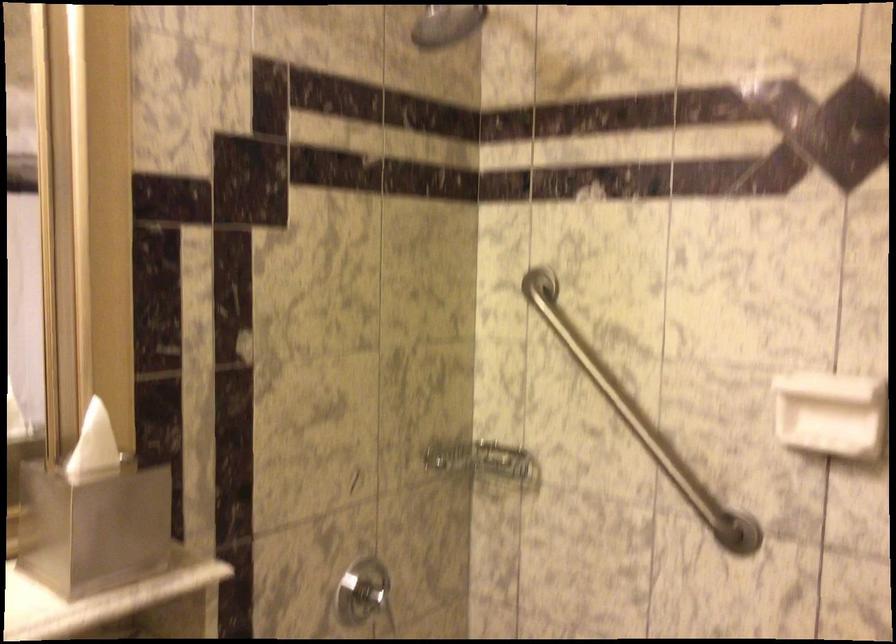
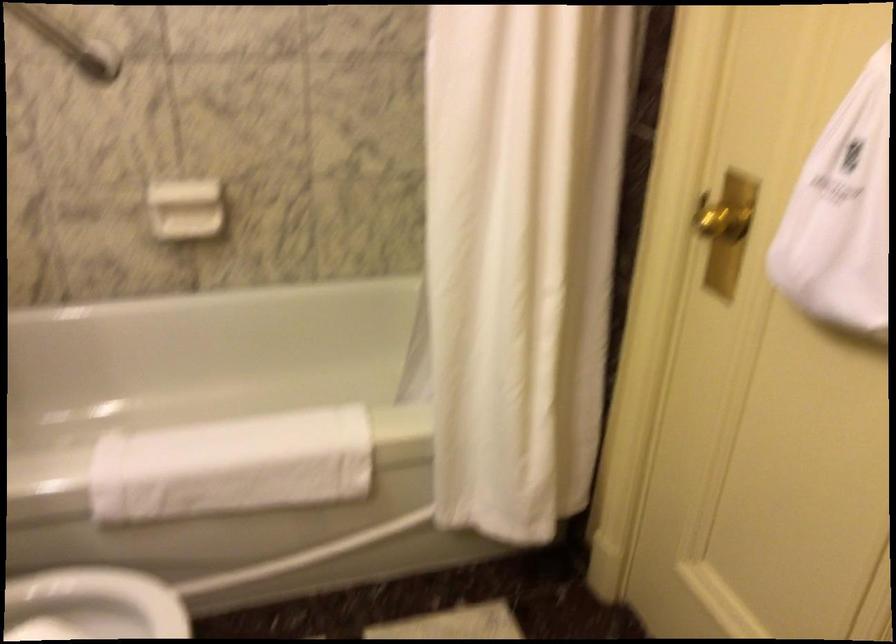
Find the pixel in the second image that matches pixel 719 512 in the first image.

(69, 42)